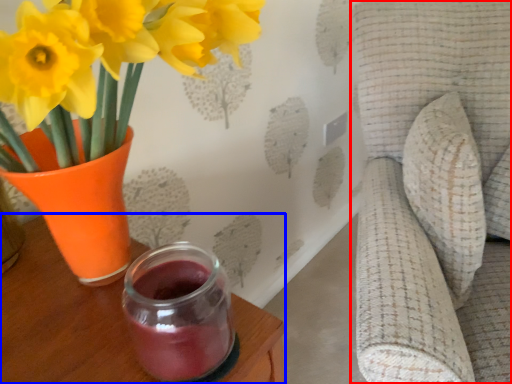
Question: Which of the following is the closest to the observer, swivel chair (highlighted by a red box) or table (highlighted by a blue box)?

Choices:
 (A) swivel chair
 (B) table

Answer: (A)